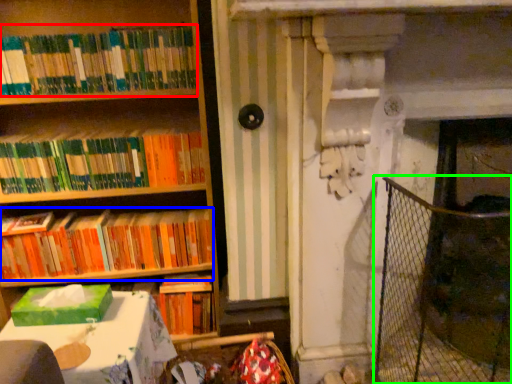
Question: Which object is the closest to the book (highlighted by a red box)? Choose among these: book (highlighted by a blue box) or fence (highlighted by a green box).

Choices:
 (A) book
 (B) fence

Answer: (A)